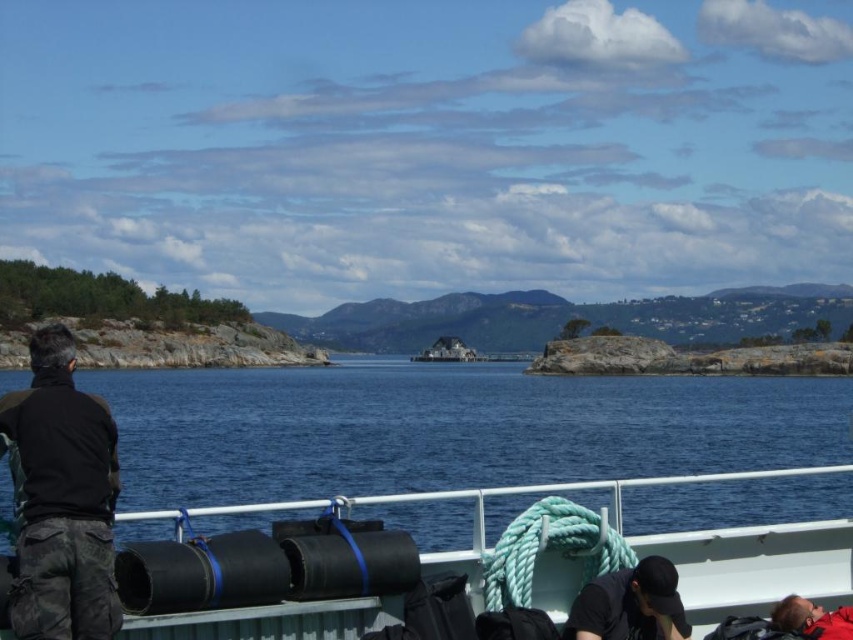
You are standing on the ferry deck and want to secure a new black cylindrical container. The existing containers are located at point (756, 563). Where should you place the new container to ensure it is near the existing ones?

Place the new container near the rubberized black tubes at center, as that is where the existing containers are located according to the coordinates provided.

You are standing on the ferry deck and want to walk from point A to point B. The ferry is moving forward. If point A is at point (71,394) and point B is at point (248,436), will you have to go around any obstacles on your path?

Point (248,436) is behind point (71,394), so if you are moving forward on the ferry deck, you would first pass point A before reaching point B. Therefore, you would not need to go around any obstacles between them as they are along the same path.

Based on the photo, you are standing on the ferry deck and want to place a rectangular box that is 2 meters wide between the blue water at center and the black matte jacket at left. Can you fit it without overlapping either object?

The blue water at center is wider than the black matte jacket at left. However, since the exact widths aren not provided, it is uncertain if the 2 meter box will fit between them. More information about the distance between the two objects is needed to determine this.